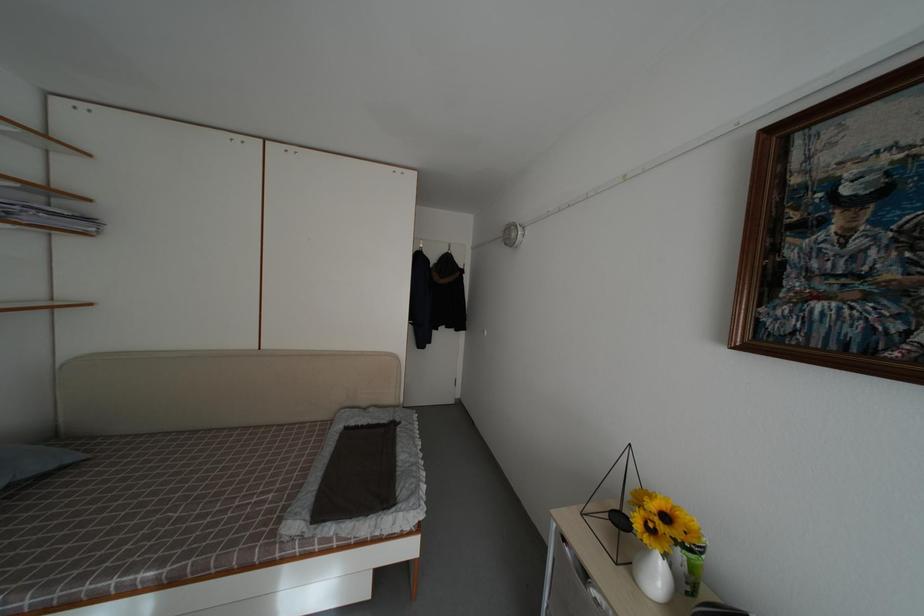
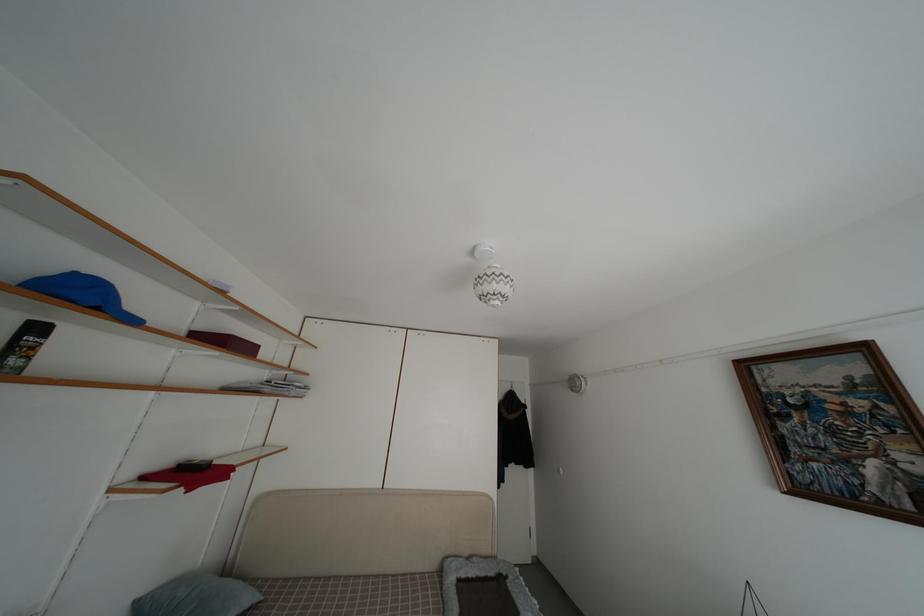
Question: The first image is from the beginning of the video and the second image is from the end. How did the camera likely rotate when shooting the video?

Choices:
 (A) Left
 (B) Right
 (C) Up
 (D) Down

Answer: (C)